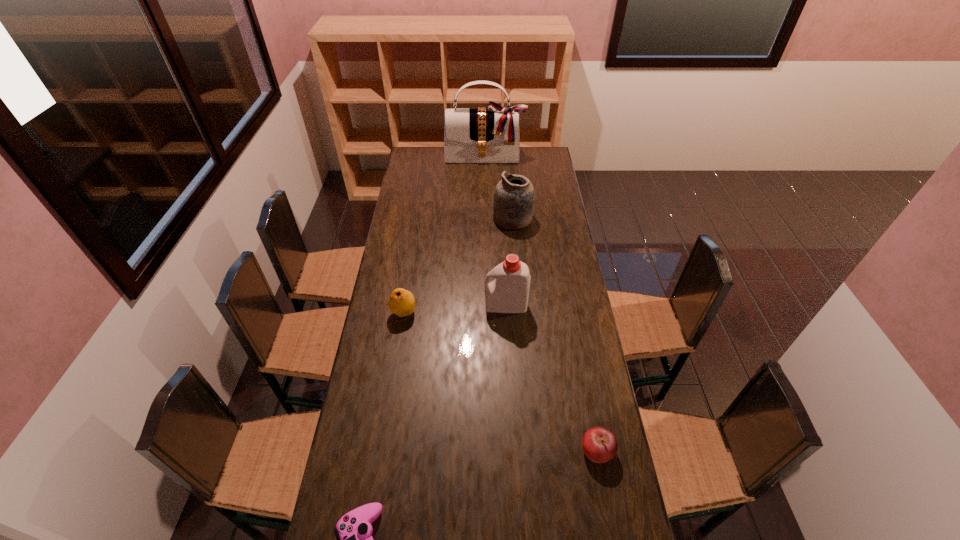
This screenshot has height=540, width=960. What are the coordinates of `free point located on the handle side of the detergent` in the screenshot? It's located at (429, 305).

Where is `blank area located on the front of the pottery`? blank area located on the front of the pottery is located at coordinates (515, 238).

Where is `free region located on the back of the pear`? This screenshot has height=540, width=960. free region located on the back of the pear is located at coordinates (410, 275).

Where is `free region located on the left of the rightmost object`? free region located on the left of the rightmost object is located at coordinates (472, 450).

Identify the location of object that is positioned at the far edge. (492, 135).

This screenshot has width=960, height=540. Find the location of `object present at the left edge`. object present at the left edge is located at coordinates (401, 302).

The height and width of the screenshot is (540, 960). I want to click on satchel positioned at the right edge, so click(492, 135).

Locate an element on the screen. Image resolution: width=960 pixels, height=540 pixels. pottery situated at the right edge is located at coordinates (514, 198).

Image resolution: width=960 pixels, height=540 pixels. What are the coordinates of `apple that is at the right edge` in the screenshot? It's located at (599, 444).

The image size is (960, 540). In order to click on object present at the far right corner in this screenshot , I will do `click(492, 135)`.